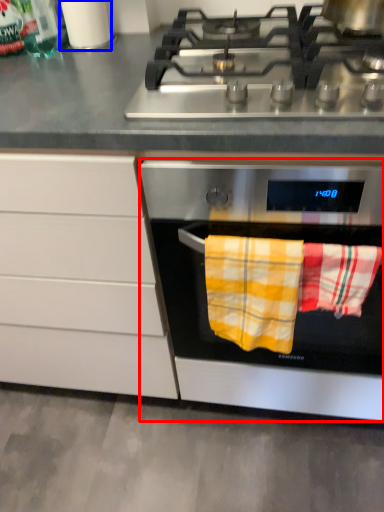
Question: Among these objects, which one is nearest to the camera, oven (highlighted by a red box) or appliance (highlighted by a blue box)?

Choices:
 (A) oven
 (B) appliance

Answer: (A)